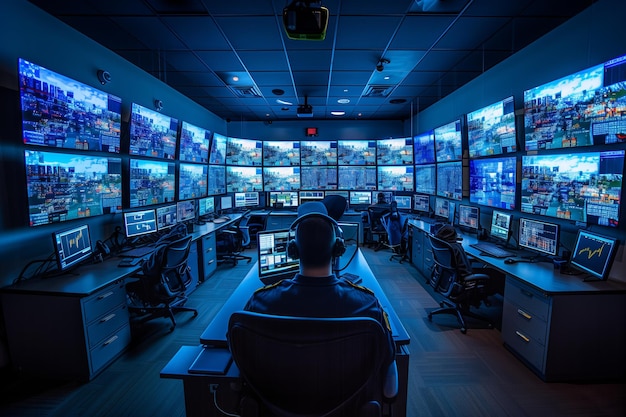
Where is `file cabinets`? This screenshot has height=417, width=626. file cabinets is located at coordinates (88, 326), (193, 265), (206, 252), (277, 222), (288, 222), (414, 245), (429, 252), (525, 317).